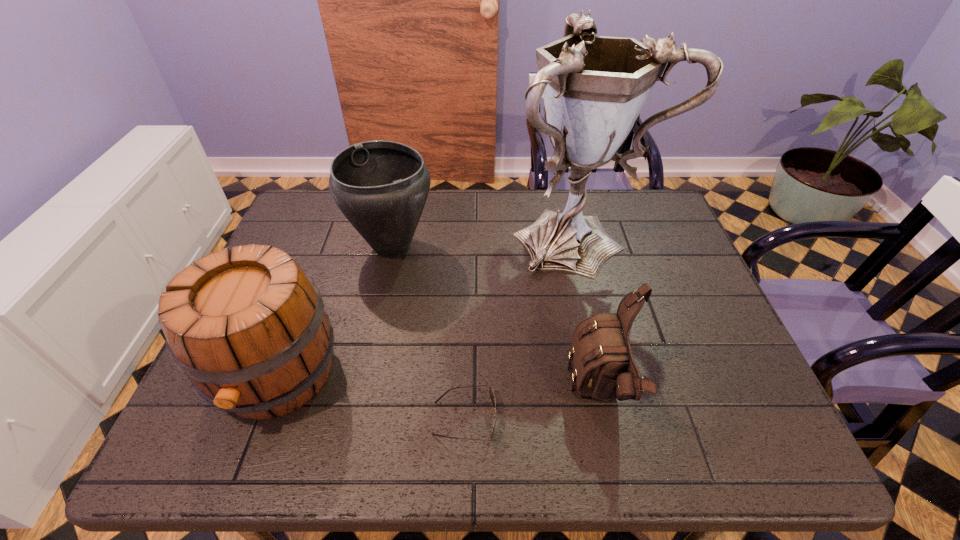
The image size is (960, 540). I want to click on trophy cup, so click(x=594, y=87).

Where is `urn`? This screenshot has height=540, width=960. urn is located at coordinates (381, 187).

Locate an element on the screen. cider is located at coordinates (248, 327).

The height and width of the screenshot is (540, 960). In order to click on shoulder bag in this screenshot , I will do `click(604, 368)`.

Identify the location of sunglasses. This screenshot has height=540, width=960. (492, 397).

Locate an element on the screen. The width and height of the screenshot is (960, 540). the shortest object is located at coordinates (492, 397).

Identify the location of vacant space situated on the left of the trophy cup. The image size is (960, 540). (475, 235).

Find the location of `free location located 0.130m on the left of the urn`. free location located 0.130m on the left of the urn is located at coordinates (303, 246).

Identify the location of blank space located 0.330m on the front-facing side of the shoulder bag. The height and width of the screenshot is (540, 960). (415, 394).

The height and width of the screenshot is (540, 960). I want to click on vacant space located on the front-facing side of the shoulder bag, so click(387, 394).